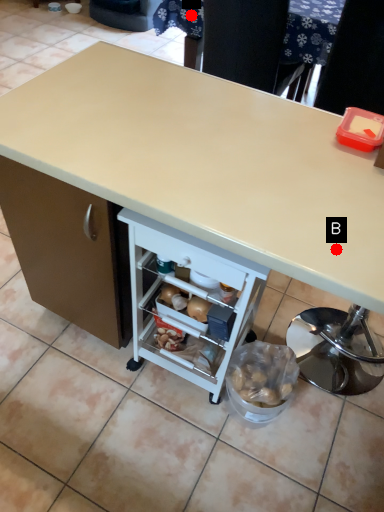
Question: Two points are circled on the image, labeled by A and B beside each circle. Which of the following is the closest to the observer?

Choices:
 (A) A is closer
 (B) B is closer

Answer: (B)